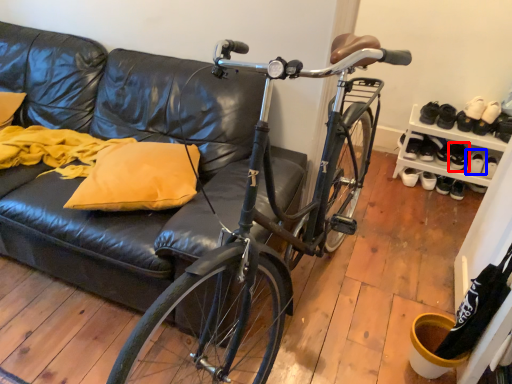
Question: Which object is further to the camera taking this photo, footwear (highlighted by a red box) or footwear (highlighted by a blue box)?

Choices:
 (A) footwear
 (B) footwear

Answer: (A)